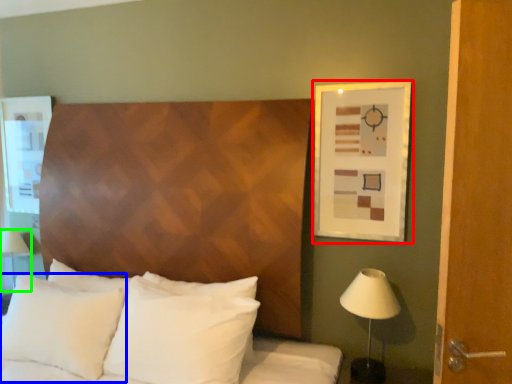
Question: Based on their relative distances, which object is farther from picture frame (highlighted by a red box)? Choose from pillow (highlighted by a blue box) and table lamp (highlighted by a green box).

Choices:
 (A) pillow
 (B) table lamp

Answer: (B)